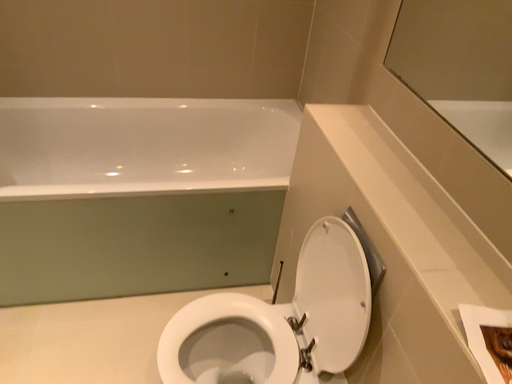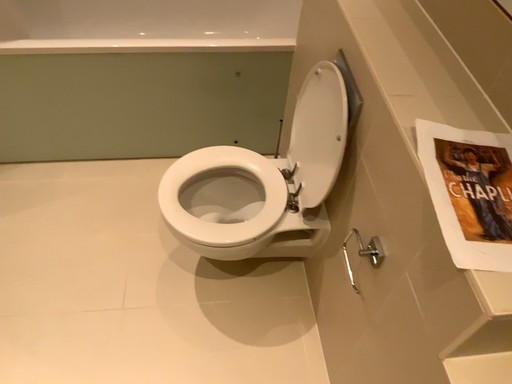
Question: Which way did the camera rotate in the video?

Choices:
 (A) rotated downward
 (B) rotated upward

Answer: (A)